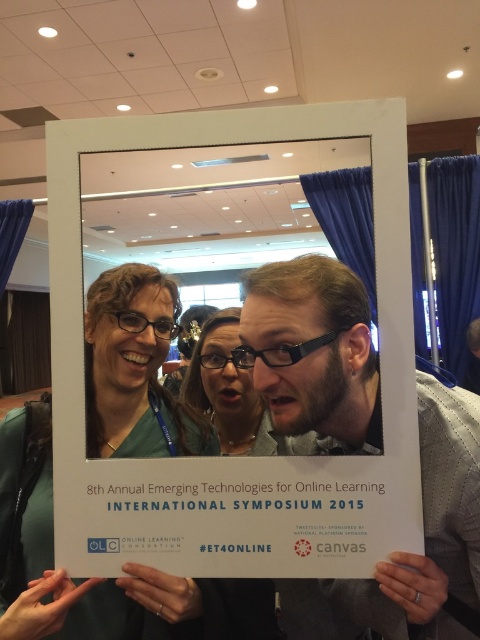
From the picture: Measure the distance from white paper at center to matte black glasses at center.

The distance of white paper at center from matte black glasses at center is 5.44 feet.

Is white paper at center further to camera compared to matte black glasses at center?

Yes, white paper at center is further from the viewer.

What do you see at coordinates (203, 385) in the screenshot? Image resolution: width=480 pixels, height=640 pixels. I see `white paper at center` at bounding box center [203, 385].

You are a GUI agent. You are given a task and a screenshot of the screen. Output one action in this format:
    pyautogui.click(x=<x>, y=<y>)
    Task: Click on the white paper at center
    This screenshot has width=480, height=640.
    Given the screenshot: What is the action you would take?
    pyautogui.click(x=203, y=385)